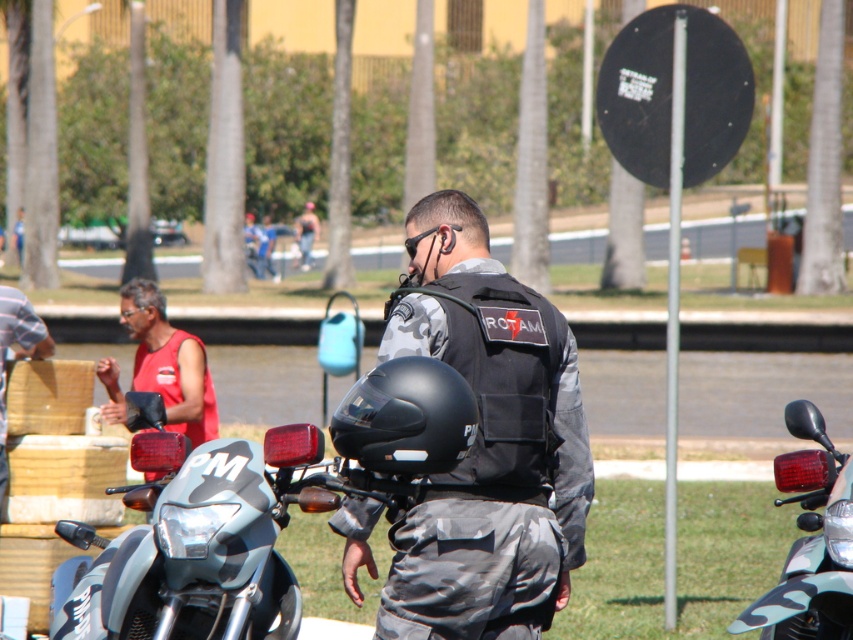
Question: Can you confirm if matte black helmet at center is positioned above red sleeveless shirt at left?

Choices:
 (A) no
 (B) yes

Answer: (A)

Question: Which of the following is the closest to the observer?

Choices:
 (A) (780, 499)
 (B) (115, 381)

Answer: (A)

Question: Can you confirm if camouflage-patterned motorcycle at center is positioned above matte black helmet at center?

Choices:
 (A) no
 (B) yes

Answer: (A)

Question: Which object is closer to the camera taking this photo?

Choices:
 (A) matte black helmet at center
 (B) camouflage uniform at center
 (C) camouflage-patterned motorcycle at center
 (D) matte black motorcycle at right

Answer: (A)

Question: Does camouflage uniform at center appear on the right side of matte black helmet at center?

Choices:
 (A) no
 (B) yes

Answer: (B)

Question: Which point is farther to the camera?

Choices:
 (A) (460, 577)
 (B) (183, 381)
 (C) (265, 611)

Answer: (B)